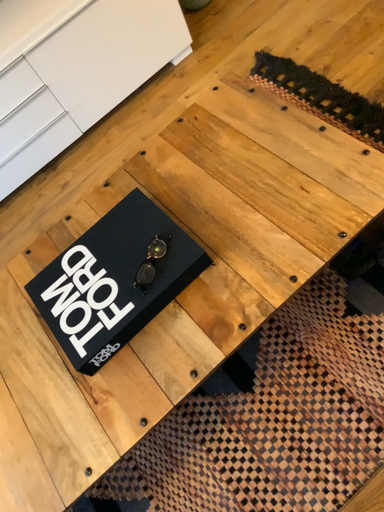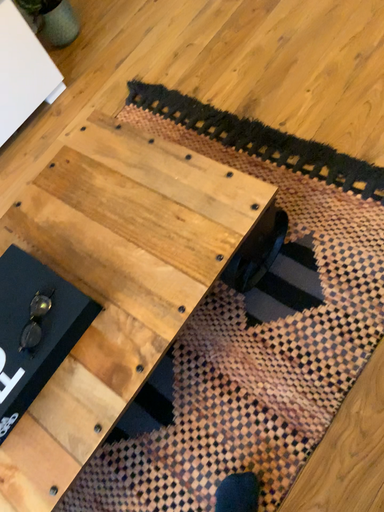
Question: How did the camera likely rotate when shooting the video?

Choices:
 (A) rotated right
 (B) rotated left

Answer: (A)